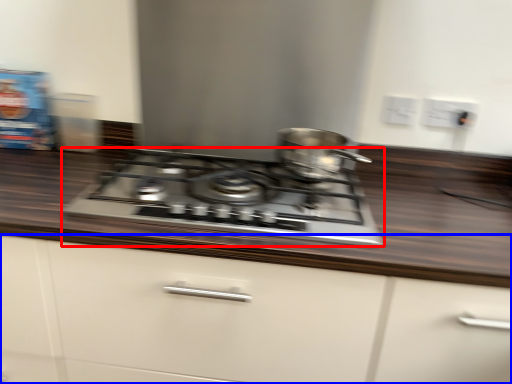
Question: Which point is further to the camera, gas stove (highlighted by a red box) or cabinetry (highlighted by a blue box)?

Choices:
 (A) gas stove
 (B) cabinetry

Answer: (A)